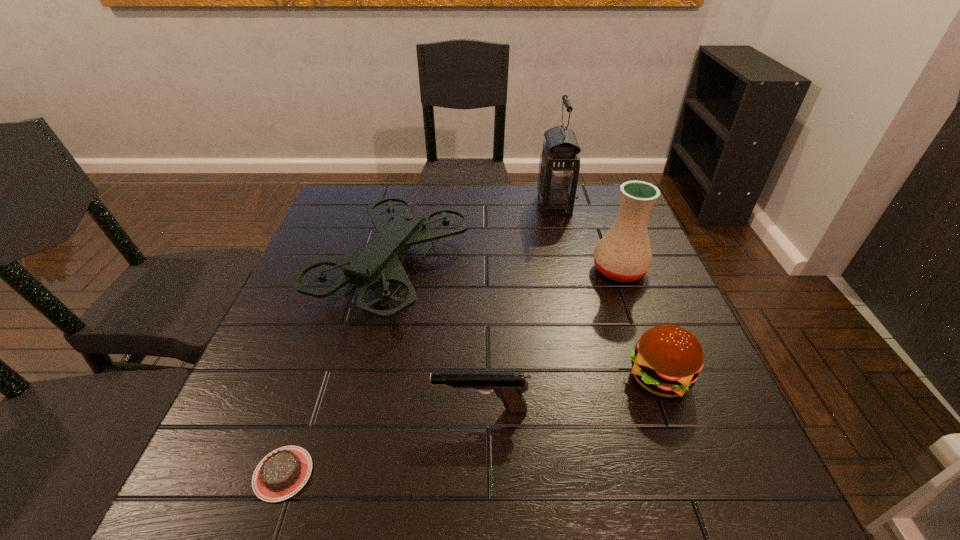
At what (x,y) coordinates should I click in order to perform the action: click on object at the near edge. Please return your answer as a coordinate pair (x, y). The height and width of the screenshot is (540, 960). Looking at the image, I should click on (282, 473).

Image resolution: width=960 pixels, height=540 pixels. Identify the location of drone that is positioned at the left edge. [379, 262].

Image resolution: width=960 pixels, height=540 pixels. What are the coordinates of `chocolate cake located at the left edge` in the screenshot? It's located at (282, 473).

At what (x,y) coordinates should I click in order to perform the action: click on pottery at the right edge. Please return your answer as a coordinate pair (x, y). The image size is (960, 540). Looking at the image, I should click on (624, 254).

The width and height of the screenshot is (960, 540). In order to click on hamburger that is positioned at the right edge in this screenshot , I will do `click(667, 360)`.

This screenshot has height=540, width=960. I want to click on object situated at the far left corner, so click(379, 262).

Image resolution: width=960 pixels, height=540 pixels. I want to click on object at the near left corner, so click(282, 473).

In the image, there is a desktop. Identify the location of vacant space at the far edge. (492, 192).

In the image, there is a desktop. Where is `vacant region at the near edge`? vacant region at the near edge is located at coordinates (441, 519).

In the image, there is a desktop. At what (x,y) coordinates should I click in order to perform the action: click on vacant space at the left edge. Please return your answer as a coordinate pair (x, y). Image resolution: width=960 pixels, height=540 pixels. Looking at the image, I should click on (352, 242).